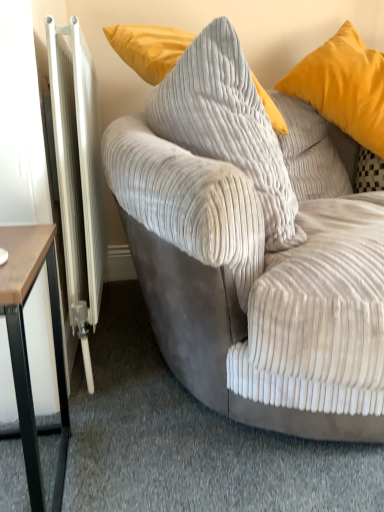
Question: Is white metallic radiator at left closer to camera compared to corduroy pillow at center, acting as the first pillow starting from the left?

Choices:
 (A) no
 (B) yes

Answer: (A)

Question: Can you confirm if white metallic radiator at left is wider than corduroy pillow at center, which is the 2th pillow in right-to-left order?

Choices:
 (A) yes
 (B) no

Answer: (B)

Question: From a real-world perspective, is white metallic radiator at left under corduroy pillow at center, which is the 2th pillow in right-to-left order?

Choices:
 (A) yes
 (B) no

Answer: (A)

Question: Is white metallic radiator at left in contact with corduroy pillow at center, which is the 2th pillow in right-to-left order?

Choices:
 (A) no
 (B) yes

Answer: (A)

Question: From the image's perspective, is white metallic radiator at left beneath corduroy pillow at center, acting as the first pillow starting from the left?

Choices:
 (A) no
 (B) yes

Answer: (B)

Question: From the image's perspective, relative to velvet gray couch at center, is corduroy pillow at center, which is the 2th pillow in right-to-left order, above or below?

Choices:
 (A) below
 (B) above

Answer: (B)

Question: Relative to velvet gray couch at center, is corduroy pillow at center, acting as the first pillow starting from the left, in front or behind?

Choices:
 (A) behind
 (B) front

Answer: (A)

Question: Is corduroy pillow at center, which is the 2th pillow in right-to-left order, inside or outside of velvet gray couch at center?

Choices:
 (A) inside
 (B) outside

Answer: (A)

Question: From a real-world perspective, relative to velvet gray couch at center, is corduroy pillow at center, acting as the first pillow starting from the left, vertically above or below?

Choices:
 (A) below
 (B) above

Answer: (B)

Question: Based on their positions, is brown wood table at left located to the left or right of corduroy pillow at center, which is the 2th pillow in right-to-left order?

Choices:
 (A) right
 (B) left

Answer: (B)

Question: From their relative heights in the image, would you say brown wood table at left is taller or shorter than corduroy pillow at center, which is the 2th pillow in right-to-left order?

Choices:
 (A) short
 (B) tall

Answer: (A)

Question: Choose the correct answer: Is brown wood table at left inside corduroy pillow at center, which is the 2th pillow in right-to-left order, or outside it?

Choices:
 (A) inside
 (B) outside

Answer: (B)

Question: Is brown wood table at left bigger or smaller than corduroy pillow at center, which is the 2th pillow in right-to-left order?

Choices:
 (A) big
 (B) small

Answer: (B)

Question: Is corduroy pillow at center, which is the 2th pillow in right-to-left order, wider or thinner than matte yellow pillow at upper right, which appears as the first pillow when viewed from the right?

Choices:
 (A) wide
 (B) thin

Answer: (B)

Question: From the image's perspective, relative to matte yellow pillow at upper right, which appears as the first pillow when viewed from the right, is corduroy pillow at center, which is the 2th pillow in right-to-left order, above or below?

Choices:
 (A) above
 (B) below

Answer: (B)